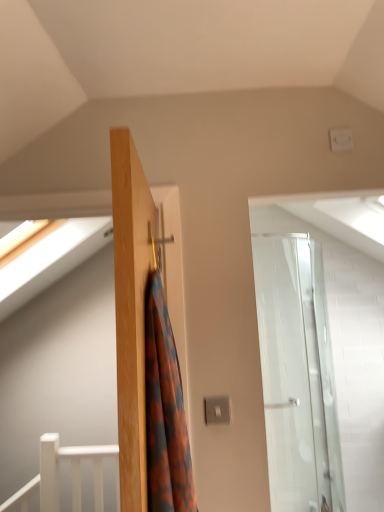
Question: Should I look upward or downward to see white matte rail at lower left?

Choices:
 (A) down
 (B) up

Answer: (A)

Question: From a real-world perspective, is orange patterned fabric at center on top of white matte rail at lower left?

Choices:
 (A) no
 (B) yes

Answer: (B)

Question: Is orange patterned fabric at center located outside white matte rail at lower left?

Choices:
 (A) no
 (B) yes

Answer: (B)

Question: Is orange patterned fabric at center turned away from white matte rail at lower left?

Choices:
 (A) no
 (B) yes

Answer: (A)

Question: Does orange patterned fabric at center appear on the right side of white matte rail at lower left?

Choices:
 (A) yes
 (B) no

Answer: (A)

Question: Does orange patterned fabric at center lie in front of white matte rail at lower left?

Choices:
 (A) yes
 (B) no

Answer: (A)

Question: Is orange patterned fabric at center at the left side of white matte rail at lower left?

Choices:
 (A) yes
 (B) no

Answer: (B)

Question: Is orange patterned fabric at center located within white matte rail at lower left?

Choices:
 (A) yes
 (B) no

Answer: (B)

Question: From a real-world perspective, is white matte rail at lower left on orange patterned fabric at center?

Choices:
 (A) no
 (B) yes

Answer: (A)

Question: Could you tell me if white matte rail at lower left is turned towards orange patterned fabric at center?

Choices:
 (A) no
 (B) yes

Answer: (A)

Question: Is white matte rail at lower left at the right side of orange patterned fabric at center?

Choices:
 (A) yes
 (B) no

Answer: (B)

Question: Considering the relative positions of white matte rail at lower left and orange patterned fabric at center in the image provided, is white matte rail at lower left behind orange patterned fabric at center?

Choices:
 (A) no
 (B) yes

Answer: (B)

Question: From the image's perspective, is white matte rail at lower left beneath orange patterned fabric at center?

Choices:
 (A) yes
 (B) no

Answer: (A)

Question: In the image, is white matte rail at lower left positioned in front of or behind orange patterned fabric at center?

Choices:
 (A) front
 (B) behind

Answer: (B)